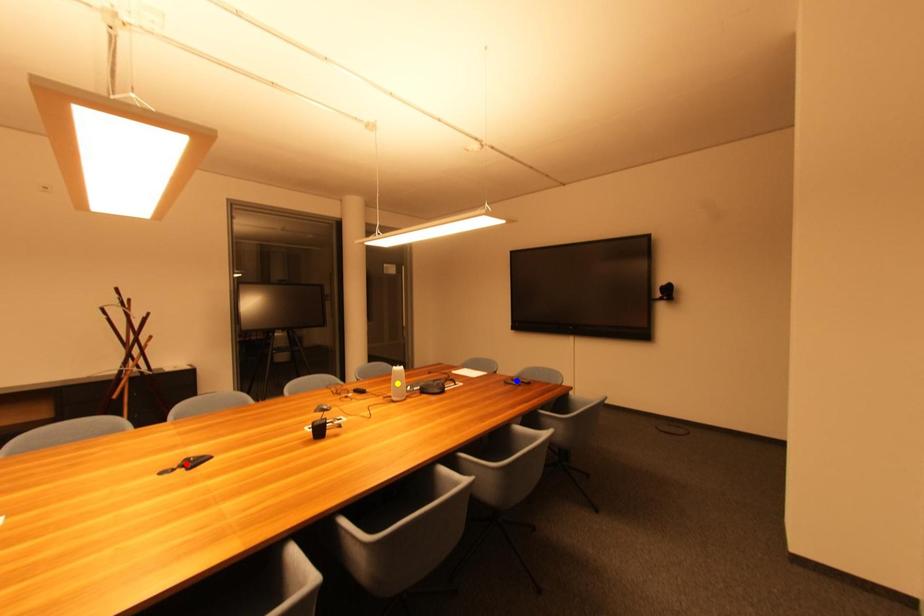
Order these from nearest to farthest:
blue point
red point
yellow point

1. red point
2. blue point
3. yellow point